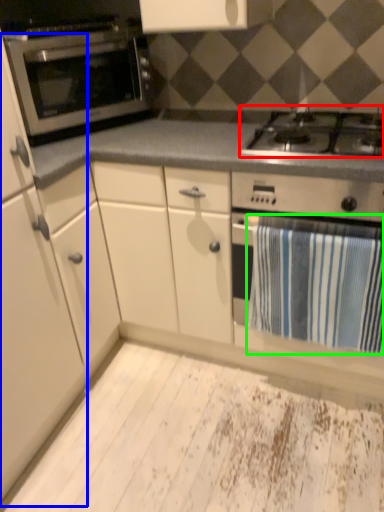
Question: Considering the real-world distances, which object is closest to gas stove (highlighted by a red box)? cabinetry (highlighted by a blue box) or bath towel (highlighted by a green box).

Choices:
 (A) cabinetry
 (B) bath towel

Answer: (B)